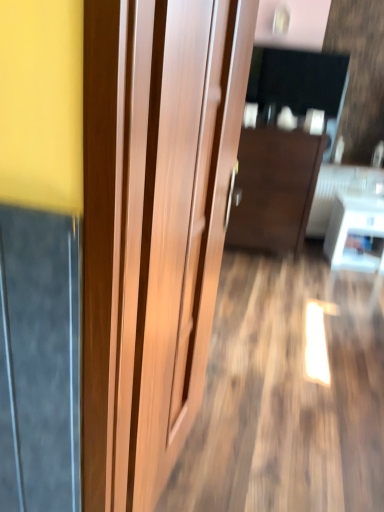
At what (x,y) coordinates should I click in order to perform the action: click on spots to the right of wooden door at center. Please return your answer as a coordinate pair (x, y). This screenshot has width=384, height=512. Looking at the image, I should click on (261, 457).